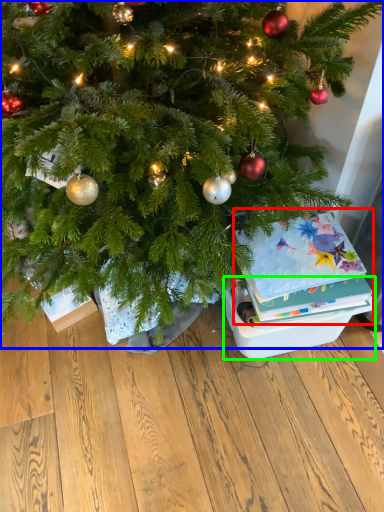
Question: Which object is the farthest from christmas card (highlighted by a red box)? Choose among these: christmas tree (highlighted by a blue box) or storage box (highlighted by a green box).

Choices:
 (A) christmas tree
 (B) storage box

Answer: (A)